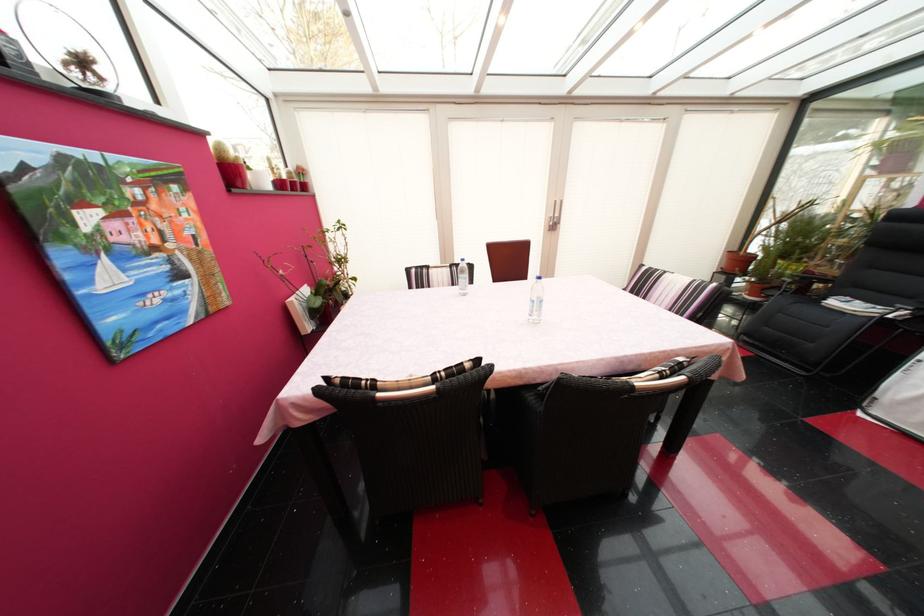
At what (x,y) coordinates should I click in order to perform the action: click on silver door handle. Please return your answer as a coordinate pair (x, y). Image resolution: width=924 pixels, height=616 pixels. Looking at the image, I should click on (554, 216).